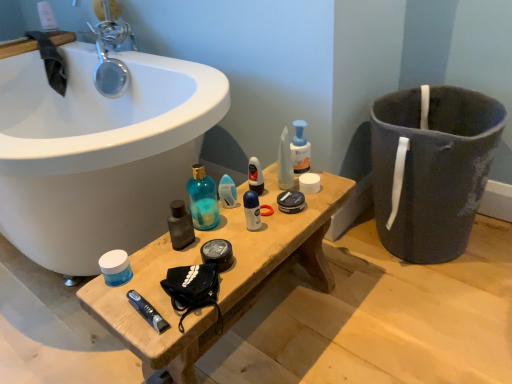
Image resolution: width=512 pixels, height=384 pixels. Identify the location of free space in front of blue matte jar at center, the 3th mouthwash in the right-to-left sequence. (123, 306).